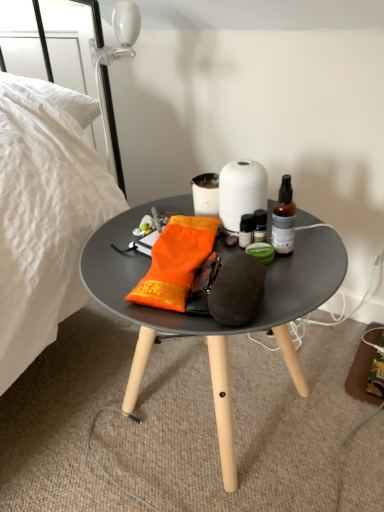
Identify the location of free spot above matte gray coffee table at center (from a real-world perspective). This screenshot has height=512, width=384. coord(203,253).